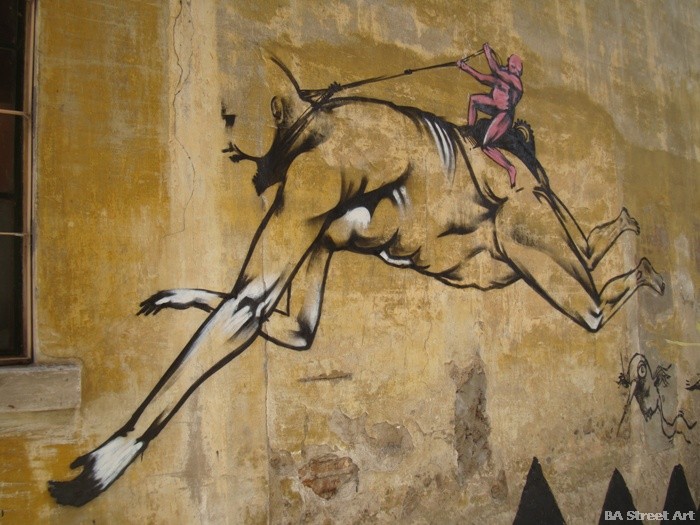
This screenshot has width=700, height=525. Identify the location of frame. (10, 326).